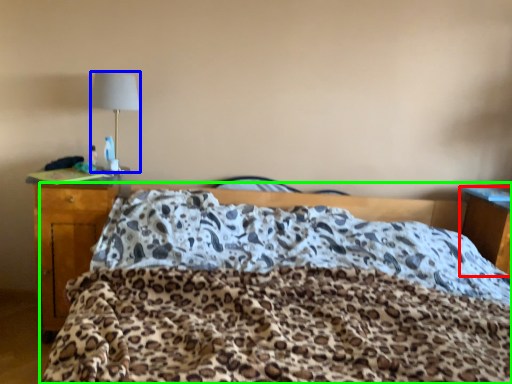
Question: Estimate the real-world distances between objects in this image. Which object is farther from nightstand (highlighted by a red box), lamp (highlighted by a blue box) or bed (highlighted by a green box)?

Choices:
 (A) lamp
 (B) bed

Answer: (A)